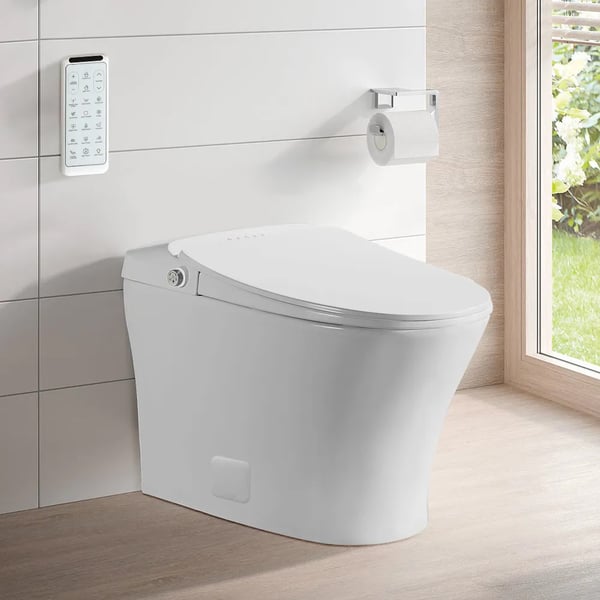
Where is `toilet seat`? The image size is (600, 600). toilet seat is located at coordinates 308,301.